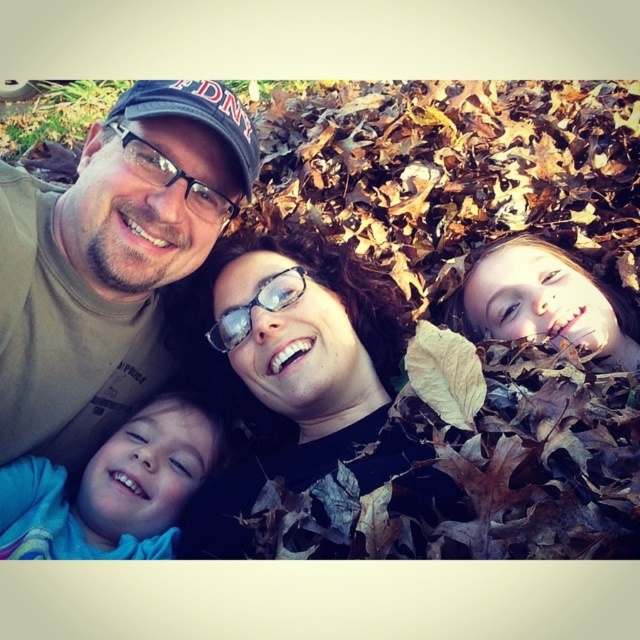
Question: Which of the following is the closest to the observer?

Choices:
 (A) blue soft fabric at lower left
 (B) matte black hair at center
 (C) black matte glasses at center

Answer: (B)

Question: Estimate the real-world distances between objects in this image. Which object is closer to the black matte glasses at center?

Choices:
 (A) matte khaki shirt at upper left
 (B) blue soft fabric at lower left

Answer: (B)

Question: Can you confirm if black matte glasses at center is smaller than blue soft fabric at lower left?

Choices:
 (A) no
 (B) yes

Answer: (A)

Question: Can you confirm if matte black hair at center is bigger than matte khaki shirt at upper left?

Choices:
 (A) no
 (B) yes

Answer: (B)

Question: Considering the real-world distances, which object is closest to the black matte glasses at center?

Choices:
 (A) matte khaki shirt at upper left
 (B) blue soft fabric at lower left

Answer: (B)

Question: From the image, what is the correct spatial relationship of black matte glasses at center in relation to matte khaki shirt at upper left?

Choices:
 (A) below
 (B) above

Answer: (A)